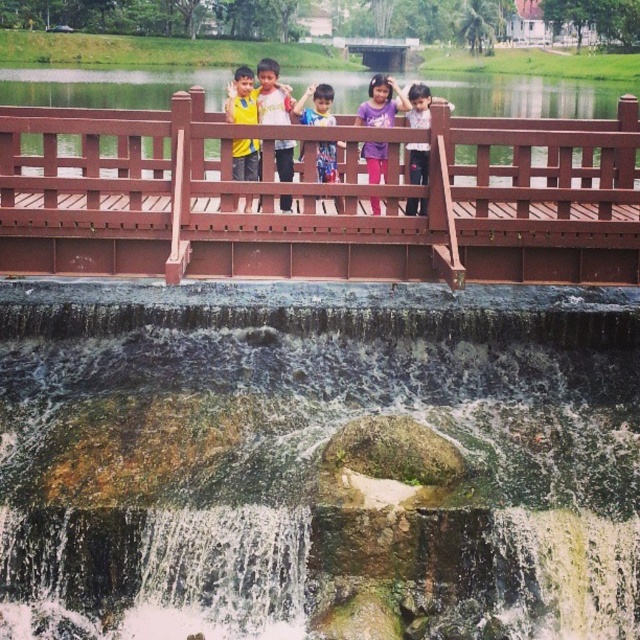
You are a photographer trying to capture the green mossy rock at center in your shot. Based on its 2D coordinates, where should you position the rock in your camera frame?

The green mossy rock at center is located at the 2D coordinates point [317,461], which means it should be positioned slightly to the right and near the bottom of the camera frame.

You are a photographer standing at the park and see the brown wooden bridge at center and the yellow matte shirt at center in the scene. Which object is closer to the photographer?

The yellow matte shirt at center is closer to the photographer because the brown wooden bridge at center is positioned under it, indicating the shirt is above and nearer to the photographer.